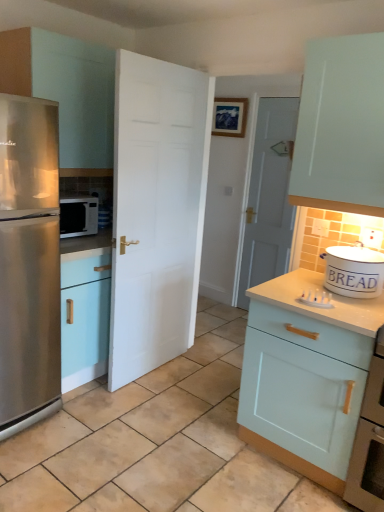
Question: Is white wooden door at center, positioned as the 1th door in right-to-left order, completely or partially outside of light blue wood cabinet at right, the first cabinetry from the bottom?

Choices:
 (A) yes
 (B) no

Answer: (A)

Question: Does white wooden door at center, the second door from the left, have a larger size compared to light blue wood cabinet at right, the second cabinetry positioned from the left?

Choices:
 (A) no
 (B) yes

Answer: (A)

Question: Does white wooden door at center, the second door from the left, have a lesser height compared to light blue wood cabinet at right, marked as the 2th cabinetry in a top-to-bottom arrangement?

Choices:
 (A) yes
 (B) no

Answer: (B)

Question: Does white wooden door at center, placed as the second door when sorted from front to back, have a lesser width compared to light blue wood cabinet at right, the first cabinetry from the bottom?

Choices:
 (A) yes
 (B) no

Answer: (A)

Question: Can you confirm if white wooden door at center, positioned as the 1th door in right-to-left order, is smaller than light blue wood cabinet at right, marked as the 2th cabinetry in a top-to-bottom arrangement?

Choices:
 (A) yes
 (B) no

Answer: (A)

Question: Is stainless steel refrigerator at left to the left or to the right of matte white cabinet at left, placed as the 1th cabinetry when sorted from top to bottom, in the image?

Choices:
 (A) left
 (B) right

Answer: (A)

Question: From the image's perspective, is stainless steel refrigerator at left positioned above or below matte white cabinet at left, arranged as the 2th cabinetry when ordered from the bottom?

Choices:
 (A) below
 (B) above

Answer: (A)

Question: Would you say stainless steel refrigerator at left is inside or outside matte white cabinet at left, the 1th cabinetry in the left-to-right sequence?

Choices:
 (A) outside
 (B) inside

Answer: (A)

Question: Looking at their shapes, would you say stainless steel refrigerator at left is wider or thinner than matte white cabinet at left, arranged as the 2th cabinetry when ordered from the bottom?

Choices:
 (A) thin
 (B) wide

Answer: (B)

Question: Is stainless steel refrigerator at left to the left or to the right of white ceramic bread bin at right in the image?

Choices:
 (A) left
 (B) right

Answer: (A)

Question: In terms of size, does stainless steel refrigerator at left appear bigger or smaller than white ceramic bread bin at right?

Choices:
 (A) small
 (B) big

Answer: (B)

Question: Is stainless steel refrigerator at left situated inside white ceramic bread bin at right or outside?

Choices:
 (A) outside
 (B) inside

Answer: (A)

Question: Is stainless steel refrigerator at left wider or thinner than white ceramic bread bin at right?

Choices:
 (A) wide
 (B) thin

Answer: (A)

Question: Is stainless steel refrigerator at left spatially inside light blue wood cabinet at right, which is counted as the first cabinetry, starting from the right, or outside of it?

Choices:
 (A) inside
 (B) outside

Answer: (B)

Question: Is stainless steel refrigerator at left in front of or behind light blue wood cabinet at right, the second cabinetry positioned from the left, in the image?

Choices:
 (A) front
 (B) behind

Answer: (B)